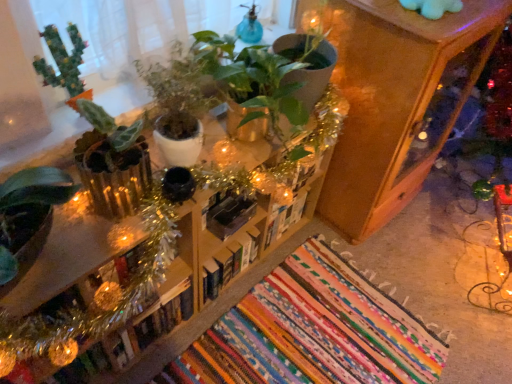
This screenshot has height=384, width=512. I want to click on vacant area located to the right-hand side of hardcover book at center, arranged as the second book when viewed from the left, so click(267, 281).